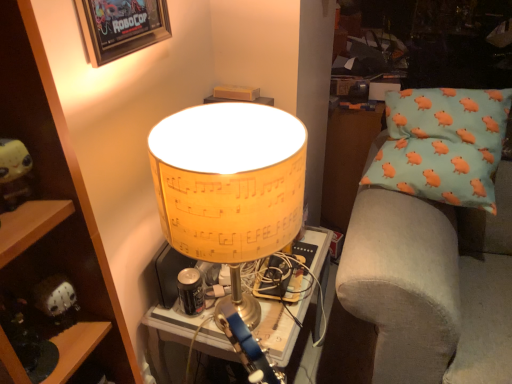
Question: Does yellow paper lampshade at center lie behind light blue fabric pillow with orange pig patterns at right?

Choices:
 (A) yes
 (B) no

Answer: (B)

Question: Considering the relative sizes of yellow paper lampshade at center and light blue fabric pillow with orange pig patterns at right in the image provided, is yellow paper lampshade at center thinner than light blue fabric pillow with orange pig patterns at right?

Choices:
 (A) no
 (B) yes

Answer: (A)

Question: Is yellow paper lampshade at center not near light blue fabric pillow with orange pig patterns at right?

Choices:
 (A) no
 (B) yes

Answer: (A)

Question: Can you confirm if yellow paper lampshade at center is smaller than light blue fabric pillow with orange pig patterns at right?

Choices:
 (A) yes
 (B) no

Answer: (A)

Question: Is yellow paper lampshade at center facing towards light blue fabric pillow with orange pig patterns at right?

Choices:
 (A) yes
 (B) no

Answer: (B)

Question: Considering the relative positions of yellow paper lampshade at center and light blue fabric pillow with orange pig patterns at right in the image provided, is yellow paper lampshade at center to the right of light blue fabric pillow with orange pig patterns at right from the viewer's perspective?

Choices:
 (A) yes
 (B) no

Answer: (B)

Question: Is yellow paper lampshade at center positioned with its back to light blue fabric pillow with orange pig patterns at right?

Choices:
 (A) yes
 (B) no

Answer: (B)

Question: Is yellow paper lampshade at center oriented towards light blue fabric pillow with orange pig patterns at right?

Choices:
 (A) yes
 (B) no

Answer: (B)

Question: Are yellow paper lampshade at center and light blue fabric pillow with orange pig patterns at right far apart?

Choices:
 (A) no
 (B) yes

Answer: (A)

Question: Is yellow paper lampshade at center closer to the viewer compared to light blue fabric pillow with orange pig patterns at right?

Choices:
 (A) yes
 (B) no

Answer: (A)

Question: Considering the relative sizes of yellow paper lampshade at center and light blue fabric pillow with orange pig patterns at right in the image provided, is yellow paper lampshade at center wider than light blue fabric pillow with orange pig patterns at right?

Choices:
 (A) yes
 (B) no

Answer: (B)

Question: From a real-world perspective, is yellow paper lampshade at center positioned over light blue fabric pillow with orange pig patterns at right based on gravity?

Choices:
 (A) no
 (B) yes

Answer: (B)

Question: Is wooden framed poster at upper left further to the viewer compared to yellow paper lampshade at center?

Choices:
 (A) no
 (B) yes

Answer: (B)